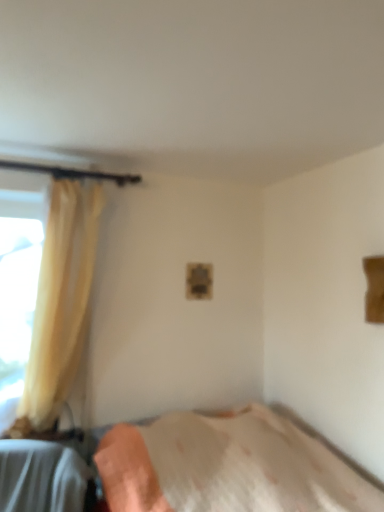
Question: Is white textured bed at lower center located outside yellow fabric curtain at left?

Choices:
 (A) yes
 (B) no

Answer: (A)

Question: Does white textured bed at lower center have a lesser height compared to yellow fabric curtain at left?

Choices:
 (A) no
 (B) yes

Answer: (B)

Question: Is white textured bed at lower center bigger than yellow fabric curtain at left?

Choices:
 (A) yes
 (B) no

Answer: (A)

Question: From a real-world perspective, is white textured bed at lower center over yellow fabric curtain at left?

Choices:
 (A) yes
 (B) no

Answer: (B)

Question: Is white textured bed at lower center next to yellow fabric curtain at left?

Choices:
 (A) yes
 (B) no

Answer: (B)

Question: Is white textured bed at lower center to the left of yellow fabric curtain at left from the viewer's perspective?

Choices:
 (A) no
 (B) yes

Answer: (A)

Question: Is yellow fabric curtain at left aimed at white textured bed at lower center?

Choices:
 (A) no
 (B) yes

Answer: (A)

Question: Can you confirm if yellow fabric curtain at left is taller than white textured bed at lower center?

Choices:
 (A) no
 (B) yes

Answer: (B)

Question: Is yellow fabric curtain at left positioned with its back to white textured bed at lower center?

Choices:
 (A) no
 (B) yes

Answer: (A)

Question: From a real-world perspective, is yellow fabric curtain at left located higher than white textured bed at lower center?

Choices:
 (A) yes
 (B) no

Answer: (A)

Question: Is yellow fabric curtain at left to the right of white textured bed at lower center from the viewer's perspective?

Choices:
 (A) no
 (B) yes

Answer: (A)

Question: Can you confirm if yellow fabric curtain at left is thinner than white textured bed at lower center?

Choices:
 (A) no
 (B) yes

Answer: (B)

Question: From their relative heights in the image, would you say yellow fabric curtain at left is taller or shorter than white textured bed at lower center?

Choices:
 (A) short
 (B) tall

Answer: (B)